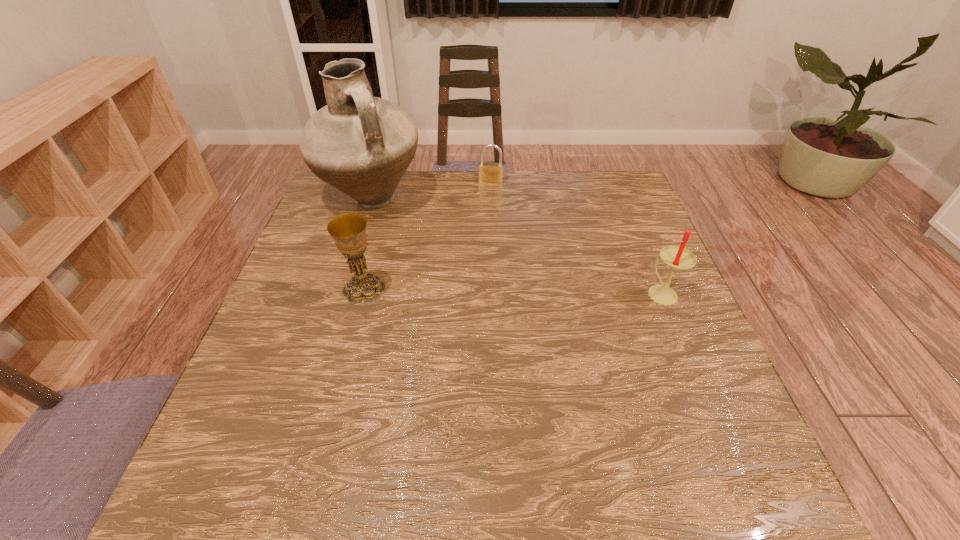
You are a GUI agent. You are given a task and a screenshot of the screen. Output one action in this format:
    pyautogui.click(x=<x>, y=<y>)
    Task: Click on the chalice
    The height and width of the screenshot is (540, 960).
    Given the screenshot: What is the action you would take?
    pyautogui.click(x=348, y=231)

Find the location of a particular element. The width and height of the screenshot is (960, 540). the rightmost object is located at coordinates (677, 257).

I want to click on the shortest object, so click(x=489, y=172).

Identify the location of padlock. This screenshot has height=540, width=960. (489, 172).

The image size is (960, 540). Identify the location of pitcher. (362, 145).

This screenshot has width=960, height=540. In order to click on vacant space located on the right of the chalice in this screenshot , I will do `click(440, 289)`.

This screenshot has width=960, height=540. Find the location of `free space located on the left of the rightmost object`. free space located on the left of the rightmost object is located at coordinates (608, 293).

Find the location of a particular element. vacant area situated 0.270m on the front-facing side of the padlock is located at coordinates (485, 238).

Identify the location of vacant space positioned 0.340m on the front-facing side of the padlock. (484, 255).

Find the location of `vacant space situated 0.260m on the front-facing side of the padlock`. vacant space situated 0.260m on the front-facing side of the padlock is located at coordinates (486, 236).